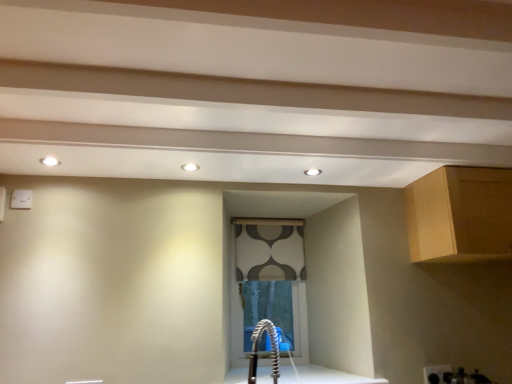
Question: From the image's perspective, is white glossy countertop at center on top of patterned fabric window at center?

Choices:
 (A) yes
 (B) no

Answer: (B)

Question: Is patterned fabric window at center inside white glossy countertop at center?

Choices:
 (A) yes
 (B) no

Answer: (B)

Question: Considering the relative sizes of white glossy countertop at center and patterned fabric window at center in the image provided, is white glossy countertop at center wider than patterned fabric window at center?

Choices:
 (A) yes
 (B) no

Answer: (A)

Question: Is white glossy countertop at center at the right side of patterned fabric window at center?

Choices:
 (A) yes
 (B) no

Answer: (A)

Question: Is white glossy countertop at center smaller than patterned fabric window at center?

Choices:
 (A) yes
 (B) no

Answer: (A)

Question: From a real-world perspective, is light brown wood cabinet at upper right above or below satin nickel faucet at lower center?

Choices:
 (A) below
 (B) above

Answer: (B)

Question: Would you say light brown wood cabinet at upper right is inside or outside satin nickel faucet at lower center?

Choices:
 (A) inside
 (B) outside

Answer: (B)

Question: From the image's perspective, is light brown wood cabinet at upper right above or below satin nickel faucet at lower center?

Choices:
 (A) above
 (B) below

Answer: (A)

Question: Considering the positions of point (432, 233) and point (272, 342), is point (432, 233) closer or farther from the camera than point (272, 342)?

Choices:
 (A) closer
 (B) farther

Answer: (A)

Question: In terms of height, does light brown wood cabinet at upper right look taller or shorter compared to white glossy countertop at center?

Choices:
 (A) tall
 (B) short

Answer: (A)

Question: Is point (458, 173) closer or farther from the camera than point (359, 380)?

Choices:
 (A) farther
 (B) closer

Answer: (B)

Question: Do you think light brown wood cabinet at upper right is within white glossy countertop at center, or outside of it?

Choices:
 (A) outside
 (B) inside

Answer: (A)

Question: Considering the positions of light brown wood cabinet at upper right and white glossy countertop at center in the image, is light brown wood cabinet at upper right wider or thinner than white glossy countertop at center?

Choices:
 (A) wide
 (B) thin

Answer: (B)

Question: From a real-world perspective, relative to light brown wood cabinet at upper right, is white glossy countertop at center vertically above or below?

Choices:
 (A) below
 (B) above

Answer: (A)

Question: Is white glossy countertop at center situated inside light brown wood cabinet at upper right or outside?

Choices:
 (A) inside
 (B) outside

Answer: (B)